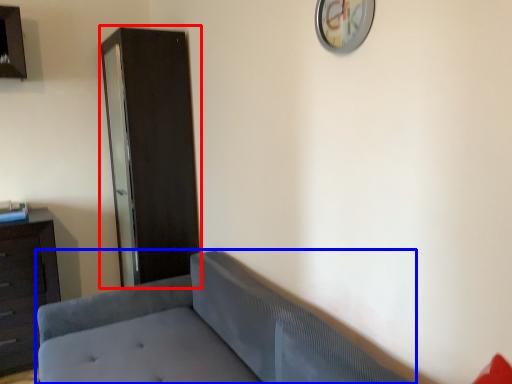
Question: Which of the following is the farthest to the observer, file cabinet (highlighted by a red box) or studio couch (highlighted by a blue box)?

Choices:
 (A) file cabinet
 (B) studio couch

Answer: (A)